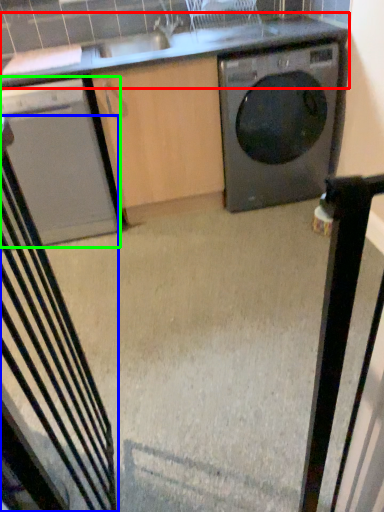
Question: Estimate the real-world distances between objects in this image. Which object is farther from countertop (highlighted by a red box), rocking chair (highlighted by a blue box) or home appliance (highlighted by a green box)?

Choices:
 (A) rocking chair
 (B) home appliance

Answer: (A)